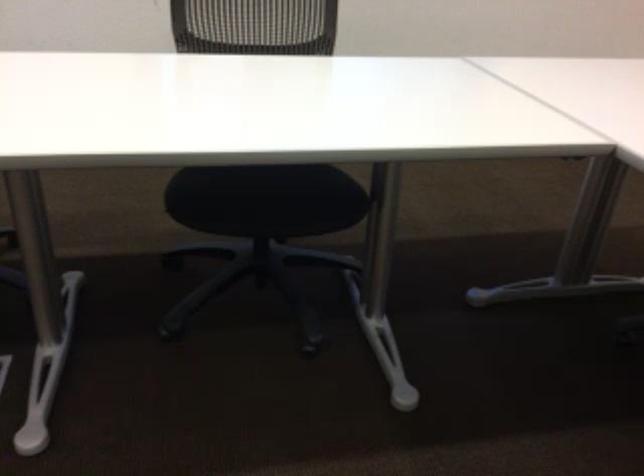
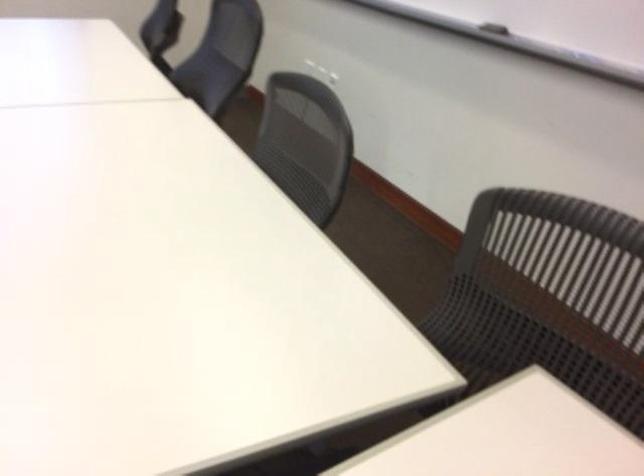
Which direction would the cameraman need to move to produce the second image?

The cameraman walked toward right, backward.